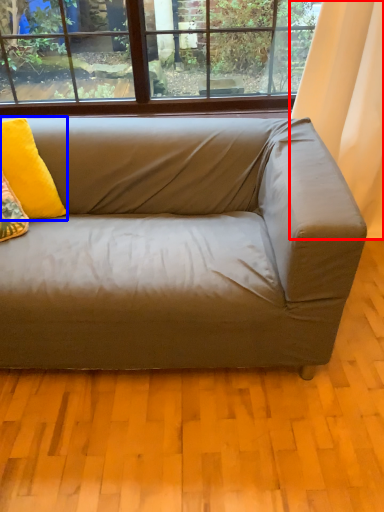
Question: Which point is further to the camera, curtain (highlighted by a red box) or pillow (highlighted by a blue box)?

Choices:
 (A) curtain
 (B) pillow

Answer: (A)